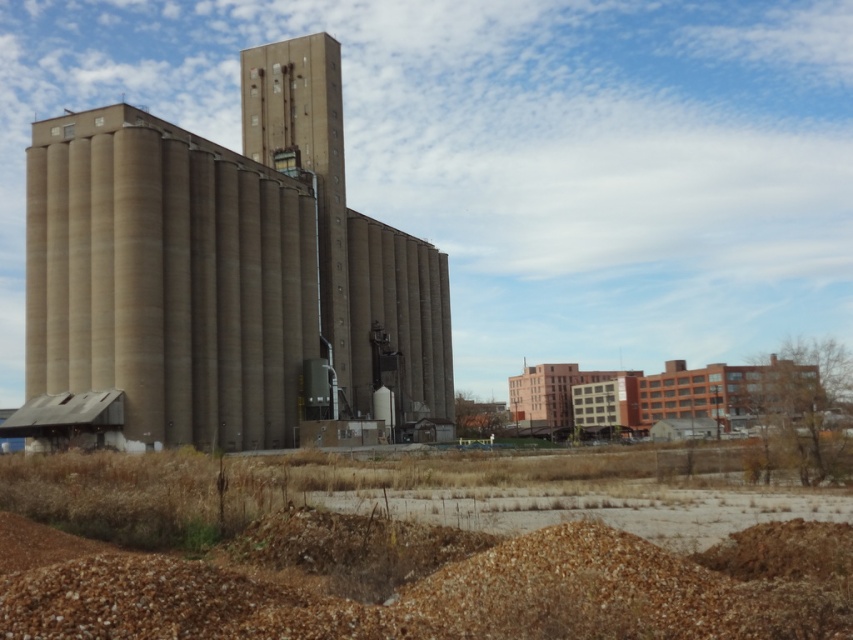
You are a maintenance worker needing to reach the concrete silo at center from your current position on the brown gravel at lower center. Given that your equipment cart can only travel 70 meters before needing a recharge, will you need to recharge before reaching the silo?

The distance between brown gravel at lower center and concrete silo at center is 72.48 meters. Since the cart can only go 70 meters before needing a recharge, you will need to recharge before reaching the silo.

You are standing at the center of the industrial area and want to place a new sensor exactly at the location of the brown gravel at lower center. What are the coordinates where you should place the sensor?

The coordinates for the brown gravel at lower center are at point (389, 563).